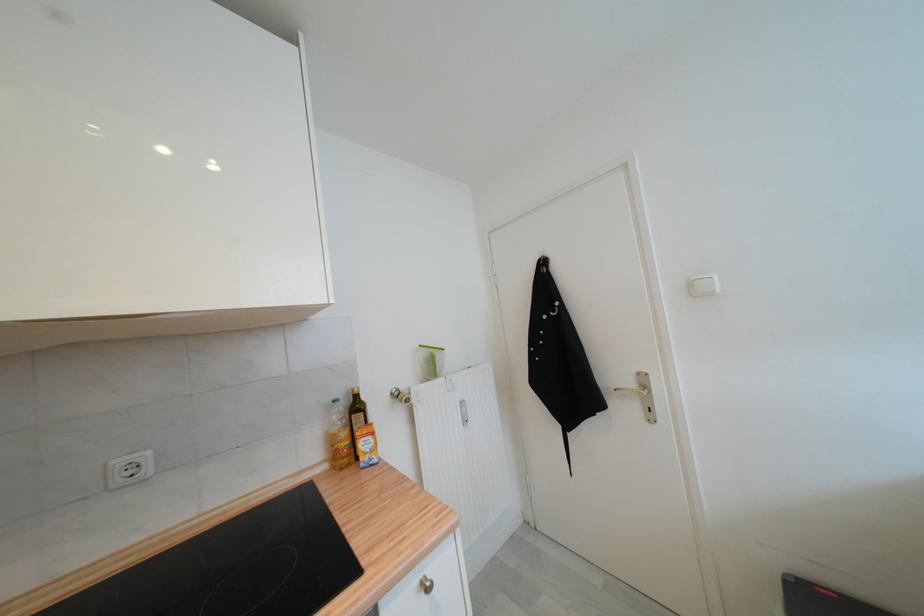
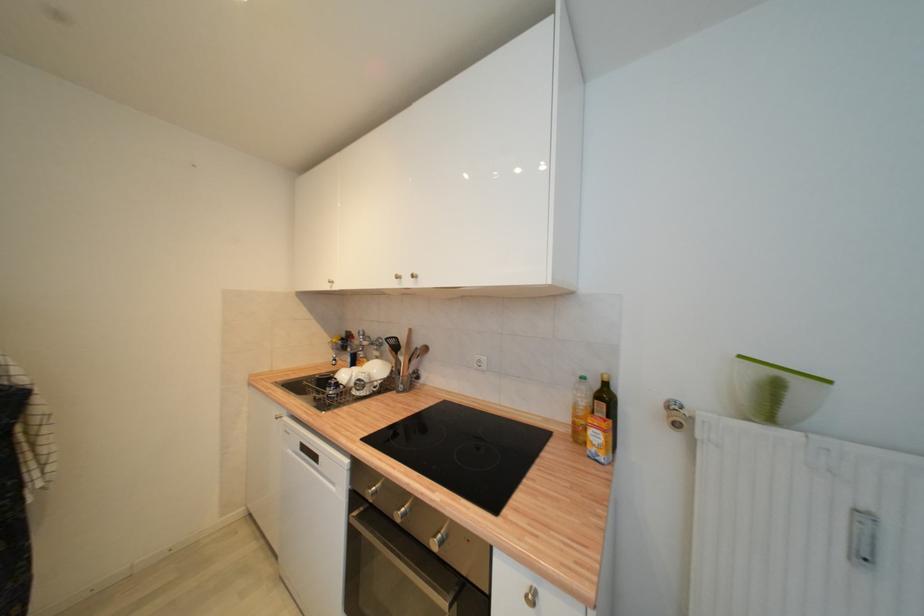
The point at (426, 347) is marked in the first image. Where is the corresponding point in the second image?

(746, 359)